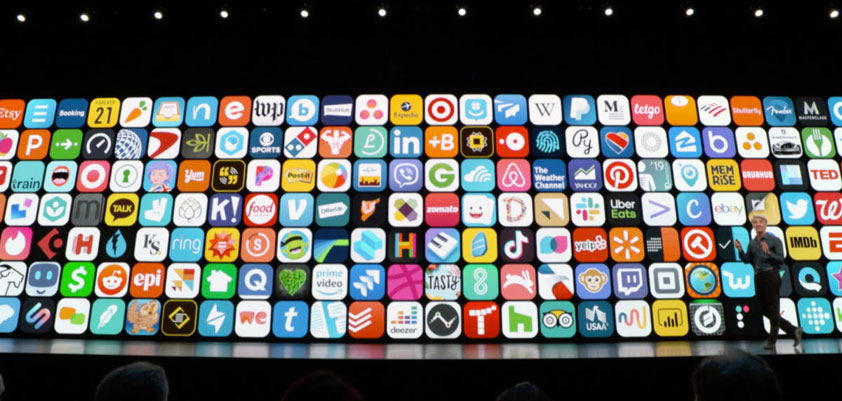
At what (x,y) coordinates should I click in order to perform the action: click on piano keys. Please return your answer as a coordinate pair (x, y). Looking at the image, I should click on pos(440,253), pos(435,243), pos(446,246), pos(444,238), pos(455,240).